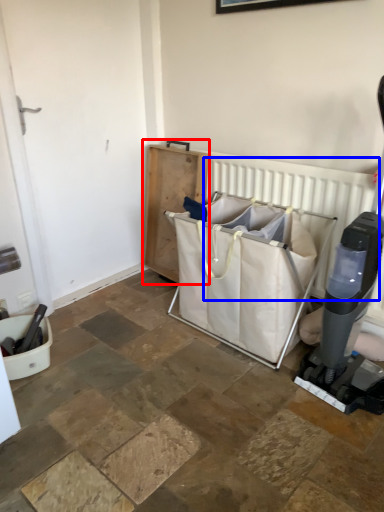
Question: Which object is further to the camera taking this photo, furniture (highlighted by a red box) or radiator (highlighted by a blue box)?

Choices:
 (A) furniture
 (B) radiator

Answer: (A)